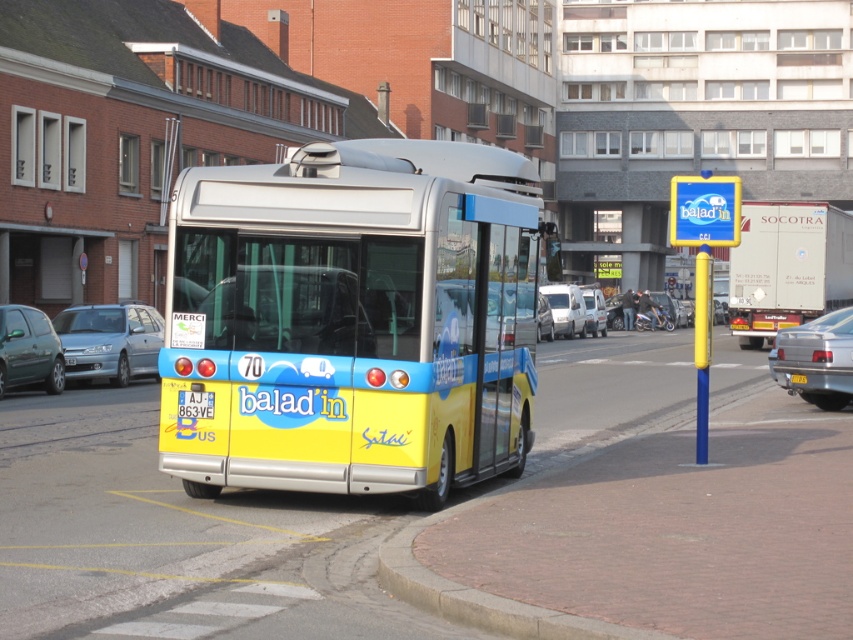
You are a delivery driver who needs to park your truck between the silver metallic sedan at right and the metallic green hatchback at left. Your truck is 2.5 meters wide. Can you fit your truck in the space between them?

The silver metallic sedan at right is wider than the metallic green hatchback at left, but the question does not provide information about the distance between them. Without knowing the actual space between the vehicles, it is impossible to determine if the truck can fit.